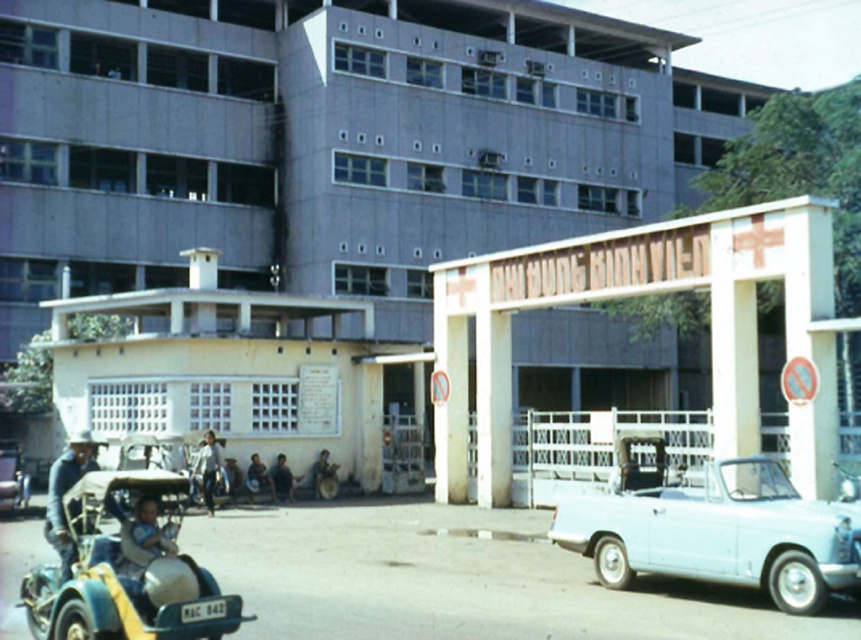
Question: Is light blue fabric baby carriage at lower left thinner than dark blue shirt at center?

Choices:
 (A) no
 (B) yes

Answer: (B)

Question: Which object is the closest to the dark blue shirt at center?

Choices:
 (A) metallic green car at lower left
 (B) light brown leather jacket at center
 (C) light blue fabric baby carriage at lower left
 (D) dark blue fabric shirt at center

Answer: (D)

Question: Which point is closer to the camera?

Choices:
 (A) dark blue jeans at center
 (B) light brown leather jacket at center
 (C) white glossy car at right
 (D) blue denim jacket at left

Answer: (D)

Question: Which point is closer to the camera?

Choices:
 (A) dark blue jeans at center
 (B) light blue fabric baby carriage at lower left
 (C) metallic yellow toy car at lower left
 (D) dark blue fabric shirt at center

Answer: (C)

Question: Is the position of blue denim jacket at left more distant than that of light blue fabric baby carriage at lower left?

Choices:
 (A) no
 (B) yes

Answer: (B)

Question: Is white glossy car at right thinner than light brown leather jacket at center?

Choices:
 (A) no
 (B) yes

Answer: (A)